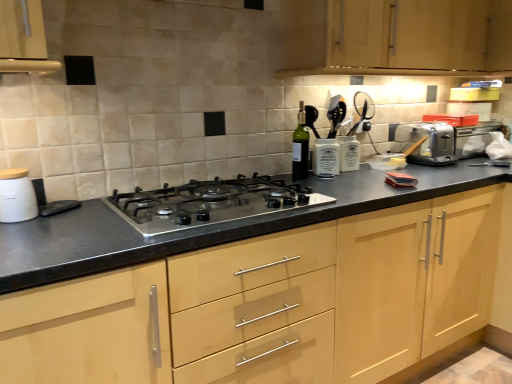
Where is `vacant space in front of green glass bottle at center`? The height and width of the screenshot is (384, 512). vacant space in front of green glass bottle at center is located at coordinates (298, 182).